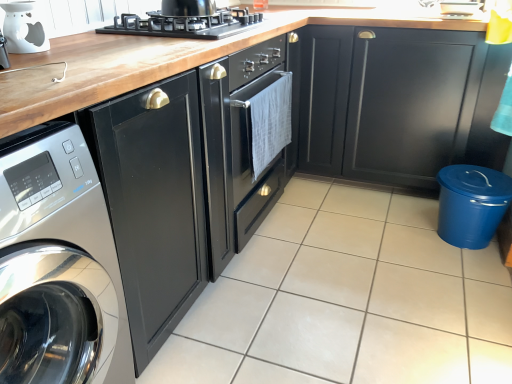
Question: Is satin silver washing machine at left positioned before glossy black cabinet at center, placed as the first cabinetry when sorted from left to right?

Choices:
 (A) no
 (B) yes

Answer: (B)

Question: Does satin silver washing machine at left have a larger size compared to glossy black cabinet at center, placed as the first cabinetry when sorted from left to right?

Choices:
 (A) yes
 (B) no

Answer: (B)

Question: Can you confirm if satin silver washing machine at left is wider than glossy black cabinet at center, placed as the first cabinetry when sorted from left to right?

Choices:
 (A) no
 (B) yes

Answer: (A)

Question: Is satin silver washing machine at left further to the viewer compared to glossy black cabinet at center, marked as the 2th cabinetry in a right-to-left arrangement?

Choices:
 (A) no
 (B) yes

Answer: (A)

Question: Can you confirm if satin silver washing machine at left is thinner than glossy black cabinet at center, marked as the 2th cabinetry in a right-to-left arrangement?

Choices:
 (A) no
 (B) yes

Answer: (B)

Question: Considering the relative positions of blue plastic trash can at lower right, positioned as the first appliance in bottom-to-top order, and glossy black cabinet at center, placed as the first cabinetry when sorted from left to right, in the image provided, is blue plastic trash can at lower right, positioned as the first appliance in bottom-to-top order, to the left or to the right of glossy black cabinet at center, placed as the first cabinetry when sorted from left to right,?

Choices:
 (A) left
 (B) right

Answer: (B)

Question: From the image's perspective, is blue plastic trash can at lower right, placed as the 1th appliance when sorted from right to left, located above or below glossy black cabinet at center, placed as the first cabinetry when sorted from left to right?

Choices:
 (A) below
 (B) above

Answer: (A)

Question: In the image, is blue plastic trash can at lower right, the second appliance from the top, positioned in front of or behind glossy black cabinet at center, placed as the first cabinetry when sorted from left to right?

Choices:
 (A) behind
 (B) front

Answer: (A)

Question: In terms of height, does blue plastic trash can at lower right, the second appliance from the top, look taller or shorter compared to glossy black cabinet at center, placed as the first cabinetry when sorted from left to right?

Choices:
 (A) tall
 (B) short

Answer: (B)

Question: Is matte black cabinet at lower right, which is the second cabinetry from left to right, taller or shorter than white glossy tile at center?

Choices:
 (A) tall
 (B) short

Answer: (A)

Question: Which is correct: matte black cabinet at lower right, which is the second cabinetry from left to right, is inside white glossy tile at center, or outside of it?

Choices:
 (A) outside
 (B) inside

Answer: (A)

Question: Is point (362, 72) closer or farther from the camera than point (243, 294)?

Choices:
 (A) farther
 (B) closer

Answer: (A)

Question: From the image's perspective, is matte black cabinet at lower right, which is the second cabinetry from left to right, above or below white glossy tile at center?

Choices:
 (A) below
 (B) above

Answer: (B)

Question: Considering the positions of point (140, 21) and point (22, 16), is point (140, 21) closer or farther from the camera than point (22, 16)?

Choices:
 (A) closer
 (B) farther

Answer: (B)

Question: In terms of height, does black matte gas stove at upper center look taller or shorter compared to white glossy oil burner at upper left, arranged as the first appliance when viewed from the front?

Choices:
 (A) short
 (B) tall

Answer: (A)